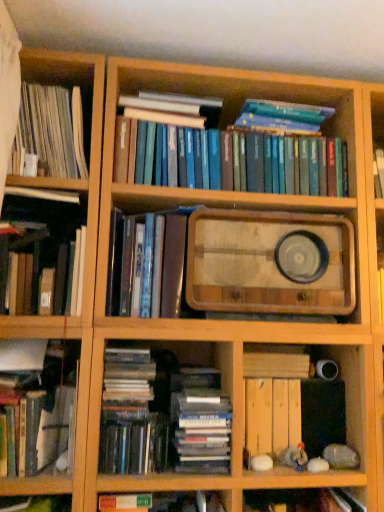
The image size is (384, 512). What do you see at coordinates (134, 445) in the screenshot?
I see `shiny black book at lower left, the seventh book positioned from the top` at bounding box center [134, 445].

You are a GUI agent. You are given a task and a screenshot of the screen. Output one action in this format:
    pyautogui.click(x=<x>, y=<y>)
    Task: Click on the shiny black book at lower left, the first book ordered from the bottom
    
    Given the screenshot: What is the action you would take?
    pyautogui.click(x=134, y=445)

At what (x,y) coordinates should I click in order to perform the action: click on hardcover book at lower left, the 2th book in the bottom-to-top sequence. Please return your answer as a coordinate pair (x, y). Looking at the image, I should click on (41, 400).

Measure the distance between hardcover book at left, arranged as the 5th book when ordered from the bottom, and camera.

hardcover book at left, arranged as the 5th book when ordered from the bottom, is 3.75 feet away from camera.

Image resolution: width=384 pixels, height=512 pixels. What do you see at coordinates (281, 413) in the screenshot?
I see `wooden planks at lower right` at bounding box center [281, 413].

Describe the element at coordinates (268, 262) in the screenshot. I see `wooden tray at center` at that location.

Find the location of `shiny black book at lower left, the first book ordered from the bottom`. shiny black book at lower left, the first book ordered from the bottom is located at coordinates (134, 445).

Considering the points (272, 279) and (287, 105), which point is behind, point (272, 279) or point (287, 105)?

Point (287, 105)

Looking at their sizes, would you say wooden tray at center is wider or thinner than blue hardcover book at upper center, marked as the 6th book in a bottom-to-top arrangement?

Considering their sizes, wooden tray at center looks broader than blue hardcover book at upper center, marked as the 6th book in a bottom-to-top arrangement.

Which is more to the left, wooden tray at center or blue hardcover book at upper center, marked as the 6th book in a bottom-to-top arrangement?

Positioned to the left is blue hardcover book at upper center, marked as the 6th book in a bottom-to-top arrangement.

From a real-world perspective, is wooden tray at center over blue hardcover book at upper center, acting as the second book starting from the top?

No, from a real-world perspective, wooden tray at center is not on top of blue hardcover book at upper center, acting as the second book starting from the top.

From the image's perspective, does shiny black book at lower left, the first book ordered from the bottom, appear higher than blue hardcover book at upper center, acting as the second book starting from the top?

Actually, shiny black book at lower left, the first book ordered from the bottom, appears below blue hardcover book at upper center, acting as the second book starting from the top, in the image.

Considering the sizes of objects shiny black book at lower left, the seventh book positioned from the top, and blue hardcover book at upper center, acting as the second book starting from the top, in the image provided, who is wider, shiny black book at lower left, the seventh book positioned from the top, or blue hardcover book at upper center, acting as the second book starting from the top,?

shiny black book at lower left, the seventh book positioned from the top.

At what (x,y) coordinates should I click in order to perform the action: click on book that is the 5th object located below the blue hardcover book at upper center, acting as the second book starting from the top (from the image's perspective). Please return your answer as a coordinate pair (x, y). The height and width of the screenshot is (512, 384). Looking at the image, I should click on (134, 445).

Looking at this image, in terms of size, does shiny black book at lower left, the first book ordered from the bottom, appear bigger or smaller than blue hardcover book at upper center, acting as the second book starting from the top?

In the image, shiny black book at lower left, the first book ordered from the bottom, appears to be smaller than blue hardcover book at upper center, acting as the second book starting from the top.

Based on their positions, is shiny black book at lower left, the seventh book positioned from the top, located to the left or right of white paperbacks at left, which is the 1th book in top-to-bottom order?

shiny black book at lower left, the seventh book positioned from the top, is positioned on white paperbacks at left, which is the 1th book in top-to-bottom order,'s right side.

Considering the sizes of objects shiny black book at lower left, the first book ordered from the bottom, and white paperbacks at left, which is the 1th book in top-to-bottom order, in the image provided, who is taller, shiny black book at lower left, the first book ordered from the bottom, or white paperbacks at left, which is the 1th book in top-to-bottom order,?

white paperbacks at left, which is the 1th book in top-to-bottom order.

From a real-world perspective, is shiny black book at lower left, the first book ordered from the bottom, positioned above or below white paperbacks at left, which is the 7th book in bottom-to-top order?

From a real-world perspective, shiny black book at lower left, the first book ordered from the bottom, is physically below white paperbacks at left, which is the 7th book in bottom-to-top order.

From the image's perspective, is blue hardcover book at upper center, acting as the second book starting from the top, on top of hardcover book at left, marked as the third book in a top-to-bottom arrangement?

Yes, from the image's perspective, blue hardcover book at upper center, acting as the second book starting from the top, is over hardcover book at left, marked as the third book in a top-to-bottom arrangement.

Considering the positions of objects blue hardcover book at upper center, marked as the 6th book in a bottom-to-top arrangement, and hardcover book at left, marked as the third book in a top-to-bottom arrangement, in the image provided, who is more to the right, blue hardcover book at upper center, marked as the 6th book in a bottom-to-top arrangement, or hardcover book at left, marked as the third book in a top-to-bottom arrangement,?

From the viewer's perspective, blue hardcover book at upper center, marked as the 6th book in a bottom-to-top arrangement, appears more on the right side.

Is blue hardcover book at upper center, acting as the second book starting from the top, positioned with its back to hardcover book at left, marked as the third book in a top-to-bottom arrangement?

No.

Consider the image. In terms of width, does blue hardcover book at upper center, marked as the 6th book in a bottom-to-top arrangement, look wider or thinner when compared to hardcover book at left, marked as the third book in a top-to-bottom arrangement?

Considering their sizes, blue hardcover book at upper center, marked as the 6th book in a bottom-to-top arrangement, looks broader than hardcover book at left, marked as the third book in a top-to-bottom arrangement.

Can you confirm if white paperbacks at left, which is the 1th book in top-to-bottom order, is thinner than shiny black book at lower left, the first book ordered from the bottom?

Yes.

How different are the orientations of white paperbacks at left, which is the 1th book in top-to-bottom order, and shiny black book at lower left, the first book ordered from the bottom, in degrees?

There is a 0.000211-degree angle between the facing directions of white paperbacks at left, which is the 1th book in top-to-bottom order, and shiny black book at lower left, the first book ordered from the bottom.

Which object is further away from the camera taking this photo, white paperbacks at left, which is the 1th book in top-to-bottom order, or shiny black book at lower left, the first book ordered from the bottom?

white paperbacks at left, which is the 1th book in top-to-bottom order, is more distant.

Does white paperbacks at left, which is the 7th book in bottom-to-top order, turn towards shiny black book at lower left, the seventh book positioned from the top?

No.

Is hardcover books at center, the third book when ordered from bottom to top, facing towards hardcover book at left, arranged as the 5th book when ordered from the bottom?

No, hardcover books at center, the third book when ordered from bottom to top, is not facing towards hardcover book at left, arranged as the 5th book when ordered from the bottom.

Is hardcover books at center, the 5th book from the top, wider or thinner than hardcover book at left, arranged as the 5th book when ordered from the bottom?

Considering their sizes, hardcover books at center, the 5th book from the top, looks broader than hardcover book at left, arranged as the 5th book when ordered from the bottom.

Considering the positions of objects hardcover books at center, the 5th book from the top, and hardcover book at left, marked as the third book in a top-to-bottom arrangement, in the image provided, who is more to the right, hardcover books at center, the 5th book from the top, or hardcover book at left, marked as the third book in a top-to-bottom arrangement,?

hardcover books at center, the 5th book from the top, is more to the right.

Is hardcover books at center, the third book when ordered from bottom to top, situated inside hardcover book at left, marked as the third book in a top-to-bottom arrangement, or outside?

The correct answer is: outside.

Is hardcover book at left, arranged as the 5th book when ordered from the bottom, not close to shiny metallic book at center, the fourth book when ordered from bottom to top?

Answer: hardcover book at left, arranged as the 5th book when ordered from the bottom, is actually quite close to shiny metallic book at center, the fourth book when ordered from bottom to top.

At what (x,y) coordinates should I click in order to perform the action: click on book that is the 1st one when counting upward from the shiny metallic book at center, the fourth book when ordered from bottom to top (from the image's perspective). Please return your answer as a coordinate pair (x, y). The height and width of the screenshot is (512, 384). Looking at the image, I should click on (45, 253).

How different are the orientations of hardcover book at left, arranged as the 5th book when ordered from the bottom, and shiny metallic book at center, the fourth book when ordered from bottom to top, in degrees?

The facing directions of hardcover book at left, arranged as the 5th book when ordered from the bottom, and shiny metallic book at center, the fourth book when ordered from bottom to top, are 0.000212 degrees apart.

From the image's perspective, relative to shiny metallic book at center, the fourth book when ordered from bottom to top, is hardcover book at left, marked as the third book in a top-to-bottom arrangement, above or below?

hardcover book at left, marked as the third book in a top-to-bottom arrangement, is above shiny metallic book at center, the fourth book when ordered from bottom to top.

Where is `paperback book that appears below the blue hardcover book at upper center, marked as the 6th book in a bottom-to-top arrangement (from the image's perspective)`? paperback book that appears below the blue hardcover book at upper center, marked as the 6th book in a bottom-to-top arrangement (from the image's perspective) is located at coordinates (268, 262).

The height and width of the screenshot is (512, 384). Identify the location of the 5th book positioned above the shiny black book at lower left, the seventh book positioned from the top (from a real-world perspective). (231, 149).

From the image, which object appears to be nearer to white paperbacks at left, which is the 7th book in bottom-to-top order, blue hardcover book at upper center, acting as the second book starting from the top, or shiny black book at lower left, the seventh book positioned from the top?

blue hardcover book at upper center, acting as the second book starting from the top, lies closer to white paperbacks at left, which is the 7th book in bottom-to-top order, than the other object.

When comparing their distances from wooden tray at center, does shiny black book at lower left, the first book ordered from the bottom, or shiny metallic book at center, which ranks as the 4th book in top-to-bottom order, seem closer?

shiny metallic book at center, which ranks as the 4th book in top-to-bottom order.

Considering their positions, is shiny metallic book at center, which ranks as the 4th book in top-to-bottom order, positioned closer to blue hardcover book at upper center, acting as the second book starting from the top, than hardcover book at left, arranged as the 5th book when ordered from the bottom?

shiny metallic book at center, which ranks as the 4th book in top-to-bottom order, is positioned closer to the anchor blue hardcover book at upper center, acting as the second book starting from the top.

Which object lies further to the anchor point shiny metallic book at center, the fourth book when ordered from bottom to top, shiny black book at lower left, the first book ordered from the bottom, or hardcover book at lower left, which is counted as the sixth book, starting from the top?

shiny black book at lower left, the first book ordered from the bottom.

Estimate the real-world distances between objects in this image. Which object is further from shiny metallic book at center, the fourth book when ordered from bottom to top, wooden tray at center or wooden planks at lower right?

wooden planks at lower right is positioned further to the anchor shiny metallic book at center, the fourth book when ordered from bottom to top.

Based on their spatial positions, is white paperbacks at left, which is the 1th book in top-to-bottom order, or wooden planks at lower right further from shiny black book at lower left, the first book ordered from the bottom?

white paperbacks at left, which is the 1th book in top-to-bottom order.

Based on their spatial positions, is wooden tray at center or hardcover books at center, the 5th book from the top, further from shiny black book at lower left, the seventh book positioned from the top?

wooden tray at center is further to shiny black book at lower left, the seventh book positioned from the top.

When comparing their distances from hardcover book at lower left, which is counted as the sixth book, starting from the top, does hardcover books at center, the third book when ordered from bottom to top, or shiny metallic book at center, which ranks as the 4th book in top-to-bottom order, seem closer?

shiny metallic book at center, which ranks as the 4th book in top-to-bottom order, lies closer to hardcover book at lower left, which is counted as the sixth book, starting from the top, than the other object.

You are a GUI agent. You are given a task and a screenshot of the screen. Output one action in this format:
    pyautogui.click(x=<x>, y=<y>)
    Task: Click on the paperback book between white paperbacks at left, which is the 1th book in top-to-bottom order, and hardcover books at center, the third book when ordered from bottom to top, in the vertical direction
    The height and width of the screenshot is (512, 384).
    Given the screenshot: What is the action you would take?
    point(268,262)

Identify the location of paperback book between white paperbacks at left, which is the 1th book in top-to-bottom order, and wooden planks at lower right vertically. Image resolution: width=384 pixels, height=512 pixels. (268, 262).

Image resolution: width=384 pixels, height=512 pixels. I want to click on paperback book between blue hardcover book at upper center, marked as the 6th book in a bottom-to-top arrangement, and shiny black book at lower left, the seventh book positioned from the top, in the vertical direction, so click(268, 262).

Where is `cabinet that lies between blue hardcover book at upper center, marked as the 6th book in a bottom-to-top arrangement, and shiny black book at lower left, the first book ordered from the bottom, from top to bottom`? This screenshot has height=512, width=384. cabinet that lies between blue hardcover book at upper center, marked as the 6th book in a bottom-to-top arrangement, and shiny black book at lower left, the first book ordered from the bottom, from top to bottom is located at coordinates (281, 413).